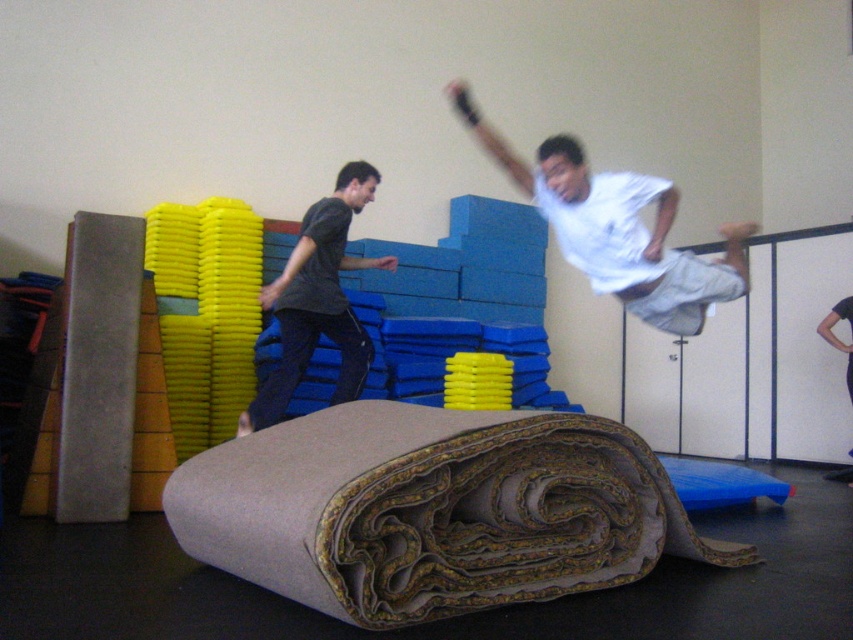
Question: Can you confirm if textured beige carpet at lower center is positioned to the left of dark gray t-shirt at left?

Choices:
 (A) no
 (B) yes

Answer: (A)

Question: Is textured beige carpet at lower center thinner than dark gray t-shirt at left?

Choices:
 (A) yes
 (B) no

Answer: (B)

Question: Which of these objects is positioned closest to the dark gray t-shirt at left?

Choices:
 (A) textured beige carpet at lower center
 (B) black fabric pants at lower right

Answer: (A)

Question: Does white matte shirt at upper center appear on the left side of black fabric pants at lower right?

Choices:
 (A) yes
 (B) no

Answer: (A)

Question: Which object is the closest to the dark gray t-shirt at left?

Choices:
 (A) textured beige carpet at lower center
 (B) white matte shirt at upper center
 (C) black fabric pants at lower right

Answer: (B)

Question: Which point is farther to the camera?

Choices:
 (A) dark gray t-shirt at left
 (B) white matte shirt at upper center

Answer: (A)